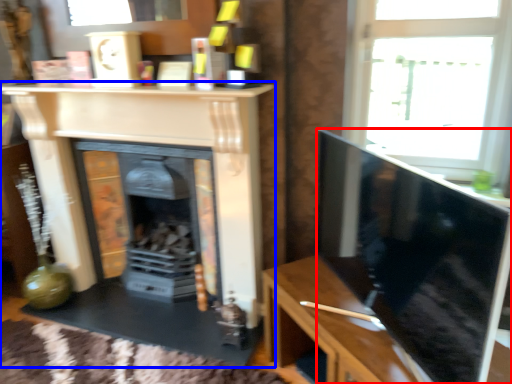
Question: Which of the following is the farthest to the observer, screen (highlighted by a red box) or fireplace (highlighted by a blue box)?

Choices:
 (A) screen
 (B) fireplace

Answer: (B)